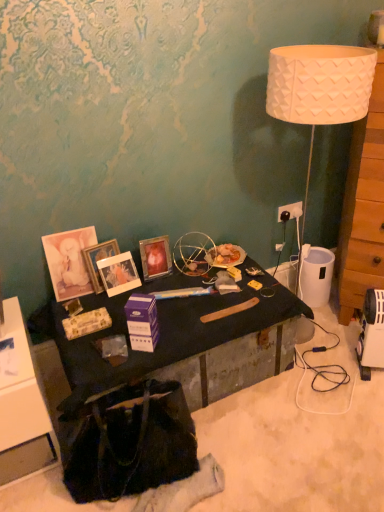
I want to click on free space above black matte desk at center (from a real-world perspective), so click(165, 304).